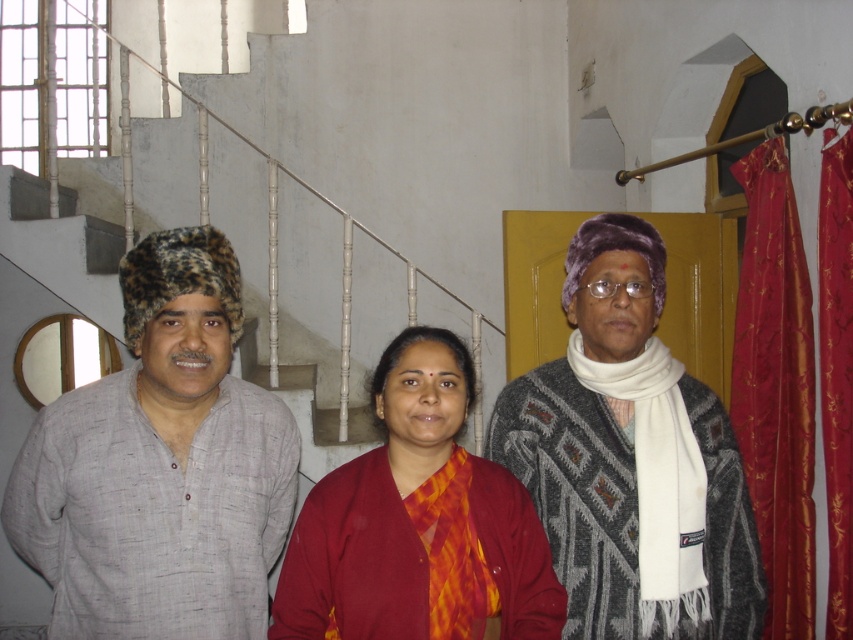
Which is more to the left, knitted woolen sweater at center or red satin curtain at right?

Positioned to the left is knitted woolen sweater at center.

Where is `knitted woolen sweater at center`? knitted woolen sweater at center is located at coordinates (631, 460).

How far apart are knitted woolen sweater at center and white textured stairs at upper left?

A distance of 2.03 meters exists between knitted woolen sweater at center and white textured stairs at upper left.

Does knitted woolen sweater at center have a lesser height compared to white textured stairs at upper left?

Yes, knitted woolen sweater at center is shorter than white textured stairs at upper left.

This screenshot has width=853, height=640. I want to click on knitted woolen sweater at center, so click(x=631, y=460).

Does light gray cotton kurta at left appear under white textured stairs at upper left?

Yes.

Is point (149, 340) closer to viewer compared to point (67, 234)?

Yes, it is in front of point (67, 234).

Which is in front, point (239, 404) or point (22, 260)?

Positioned in front is point (239, 404).

You are a GUI agent. You are given a task and a screenshot of the screen. Output one action in this format:
    pyautogui.click(x=<x>, y=<y>)
    Task: Click on the light gray cotton kurta at left
    The image size is (853, 640).
    Given the screenshot: What is the action you would take?
    pyautogui.click(x=160, y=465)